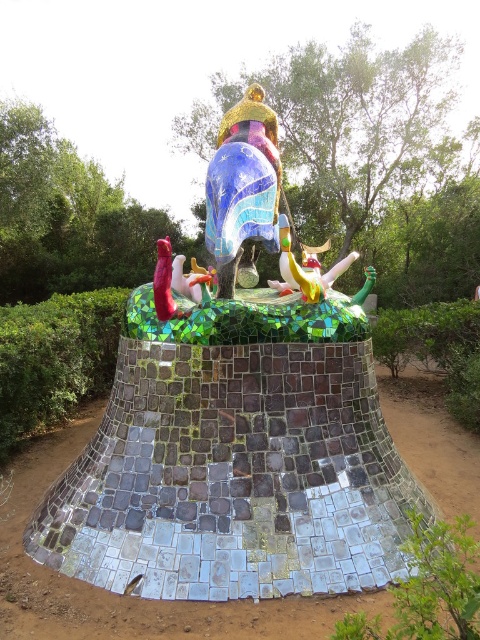
You are standing in front of a sculpture and want to take a photo of the entire mosaic mosaic horse at center. If your camera has a maximum focus range of 10 feet, will you be able to capture it clearly?

The mosaic mosaic horse at center is 9.42 feet away from the camera, which is within the maximum focus range of 10 feet. Therefore, you can capture it clearly.

You are an artist who wants to create a miniature version of the sculpture. You have both the mosaic mosaic horse at center and the shiny yellow and green toy at center in front of you. Which object should you choose to ensure the miniature is smaller than the original?

The mosaic mosaic horse at center has a smaller size compared to the shiny yellow and green toy at center, so choosing the mosaic mosaic horse at center would ensure the miniature is smaller than the original.

You are an artist standing at the origin point of the coordinate system. You want to locate the mosaic mosaic horse at center. What are its coordinates?

The mosaic mosaic horse at center is located at coordinates point (x=235, y=426).